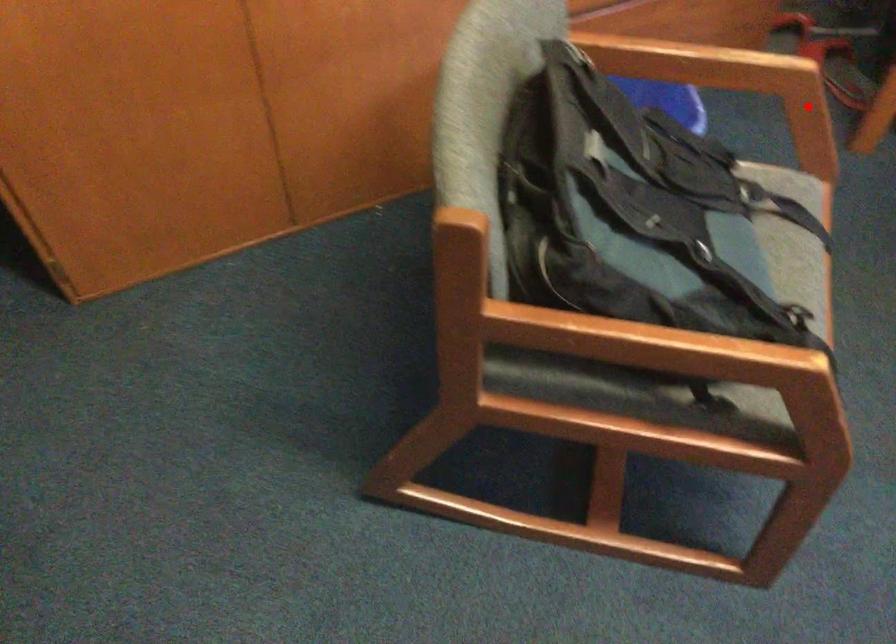
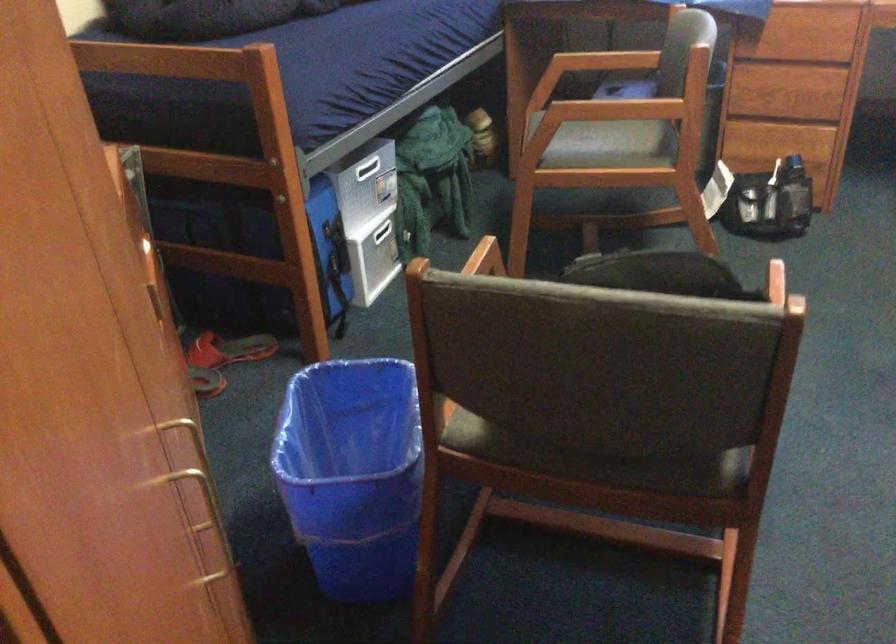
Find the pixel in the second image that matches the highlighted location in the first image.

(487, 257)